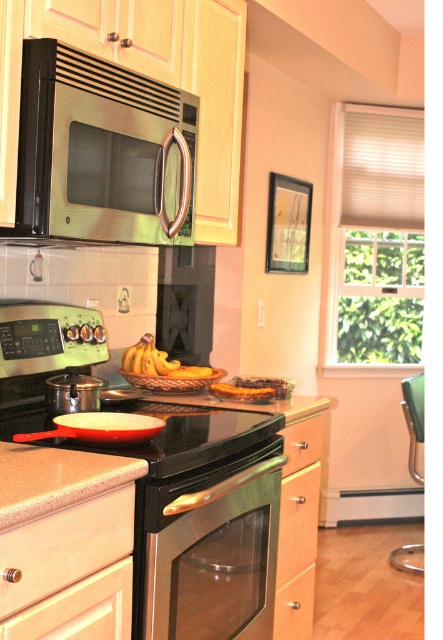
You are a chef preparing breakfast and see the yellow matte bananas at center and the golden brown bread at center on the kitchen counter. Which item is positioned higher than the other?

The yellow matte bananas at center is above the golden brown bread at center, so the bananas are positioned higher than the bread.

Looking at this image, you are organizing kitchen utensils and need to store a large set of measuring cups. Which drawer between the white matte drawer at lower left and the matte wood drawer at lower center would you choose based on their sizes?

The matte wood drawer at lower center is larger than the white matte drawer at lower left, so you should choose the matte wood drawer at lower center to store the large set of measuring cups.